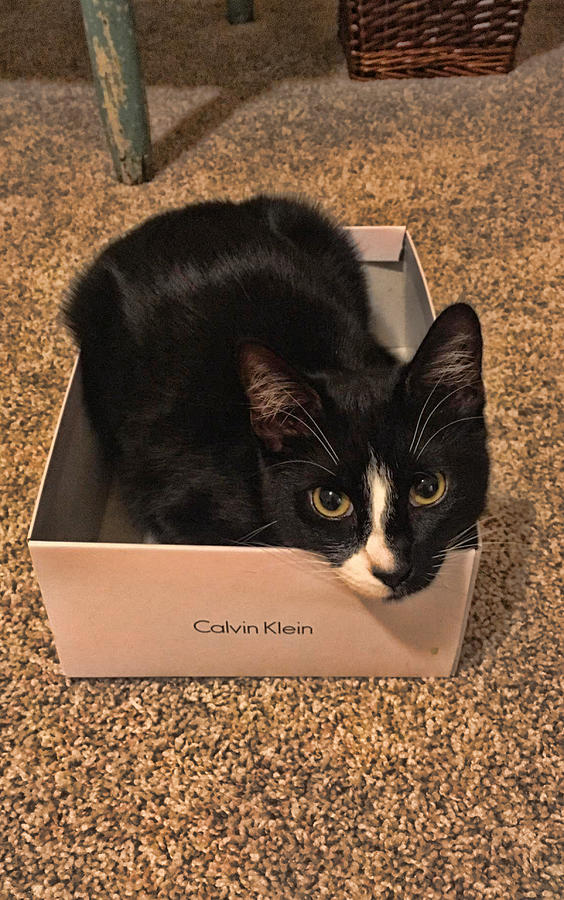
This screenshot has height=900, width=564. In order to click on table leg in this screenshot , I will do `click(121, 84)`.